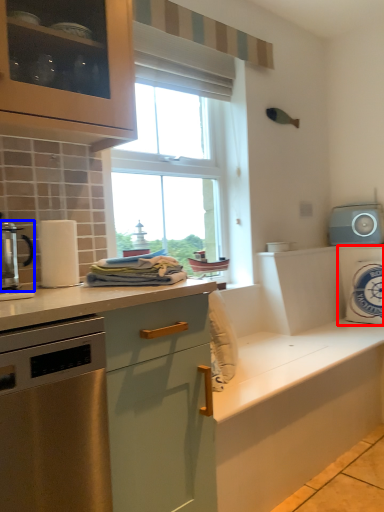
Question: Which object appears closest to the camera in this image, appliance (highlighted by a red box) or kitchen appliance (highlighted by a blue box)?

Choices:
 (A) appliance
 (B) kitchen appliance

Answer: (B)